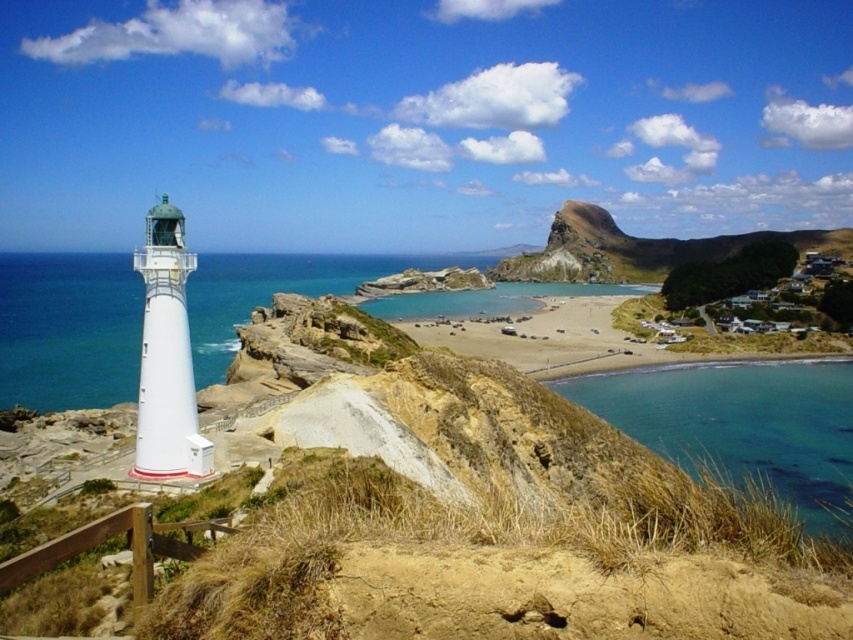
You are a photographer planning to capture the reflection of the lighthouse in the water. You have two options for positioning your camera near the white glossy water at left or the clear blue water at lower right. Which location would provide a wider area to frame the lighthouse reflection?

The white glossy water at left has a greater width than the clear blue water at lower right, so positioning the camera there would allow for a wider area to frame the lighthouse reflection.